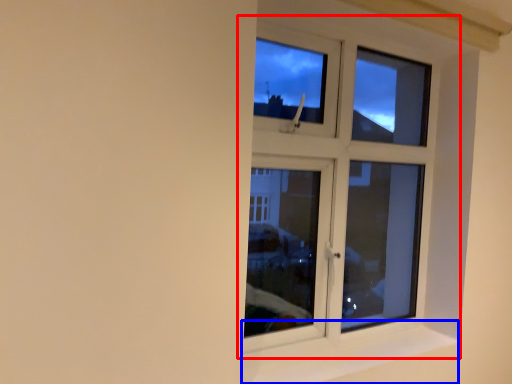
Question: Which object is closer to the camera taking this photo, window (highlighted by a red box) or window sill (highlighted by a blue box)?

Choices:
 (A) window
 (B) window sill

Answer: (B)